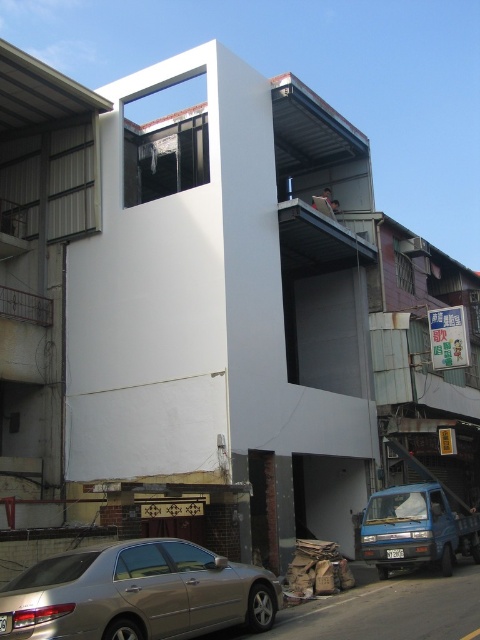
Who is positioned more to the left, gold metallic car at lower left or blue matte van at lower right?

gold metallic car at lower left

Image resolution: width=480 pixels, height=640 pixels. What do you see at coordinates (136, 593) in the screenshot? I see `gold metallic car at lower left` at bounding box center [136, 593].

The height and width of the screenshot is (640, 480). Describe the element at coordinates (136, 593) in the screenshot. I see `gold metallic car at lower left` at that location.

This screenshot has height=640, width=480. In order to click on gold metallic car at lower left in this screenshot , I will do `click(136, 593)`.